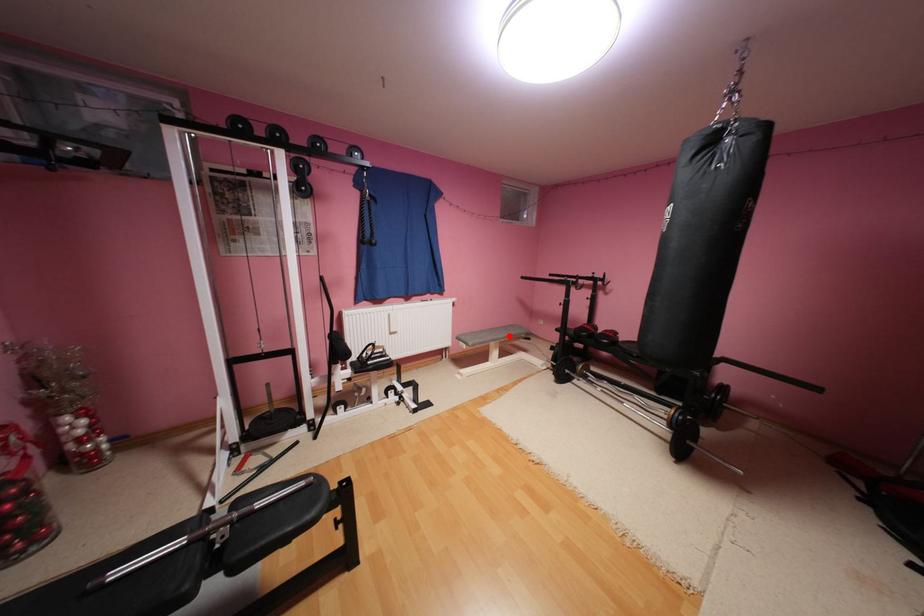
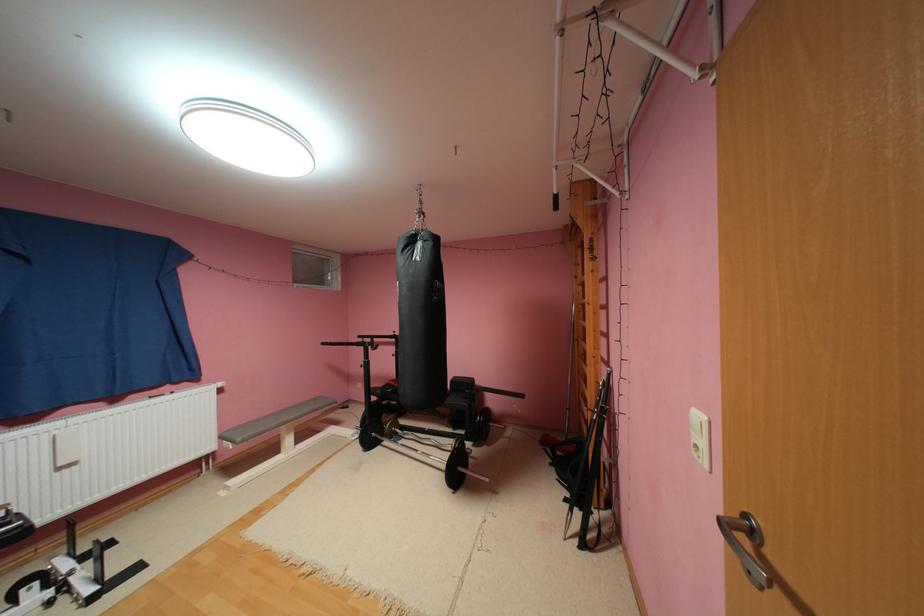
Question: I am providing you with two images of the same scene from different viewpoints. A red point is marked on the first image. At the location where the point appears in image 1, is it still visible in image 2?

Choices:
 (A) Yes
 (B) No

Answer: (A)